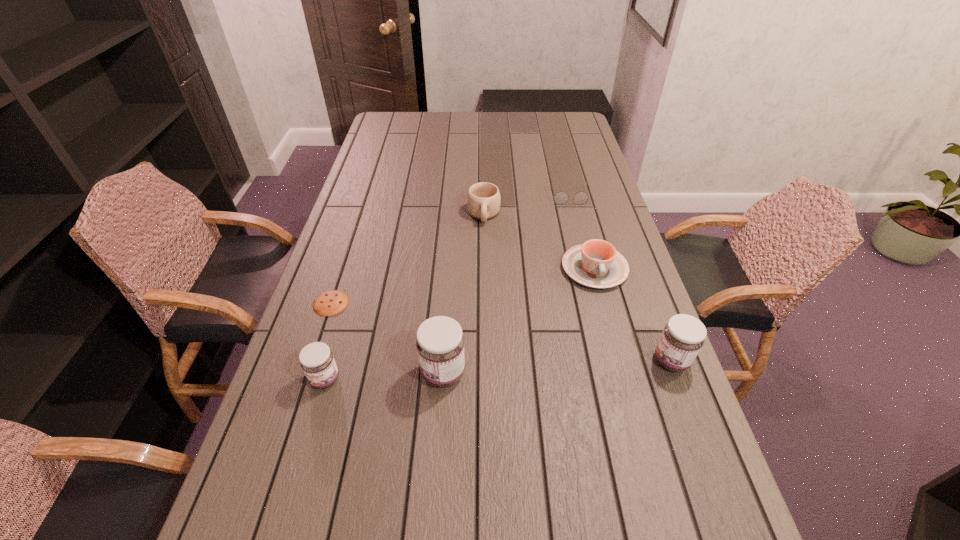
The height and width of the screenshot is (540, 960). I want to click on free spot between the second tallest jam and the tallest object, so click(x=558, y=367).

Locate an element on the screen. This screenshot has height=540, width=960. free point between the shortest jam and the chinaware is located at coordinates (460, 324).

Find the location of a particular element. free space that is in between the mug and the leftmost jam is located at coordinates (404, 297).

Image resolution: width=960 pixels, height=540 pixels. Identify the location of vacant region between the second shortest object and the leftmost jam. (446, 287).

Identify the location of vacant area that lies between the chinaware and the leftmost jam. The width and height of the screenshot is (960, 540). (460, 324).

In order to click on free space between the rightmost jam and the tallest object in this screenshot , I will do `click(558, 367)`.

Locate an element on the screen. This screenshot has height=540, width=960. vacant area that lies between the mug and the chinaware is located at coordinates (540, 241).

Image resolution: width=960 pixels, height=540 pixels. Identify the location of free space between the cookie and the mug. (407, 259).

Find the location of a particular element. free spot between the tallest object and the second shortest object is located at coordinates point(506,284).

Locate an element on the screen. Image resolution: width=960 pixels, height=540 pixels. vacant space that's between the cookie and the second tallest jam is located at coordinates (501, 332).